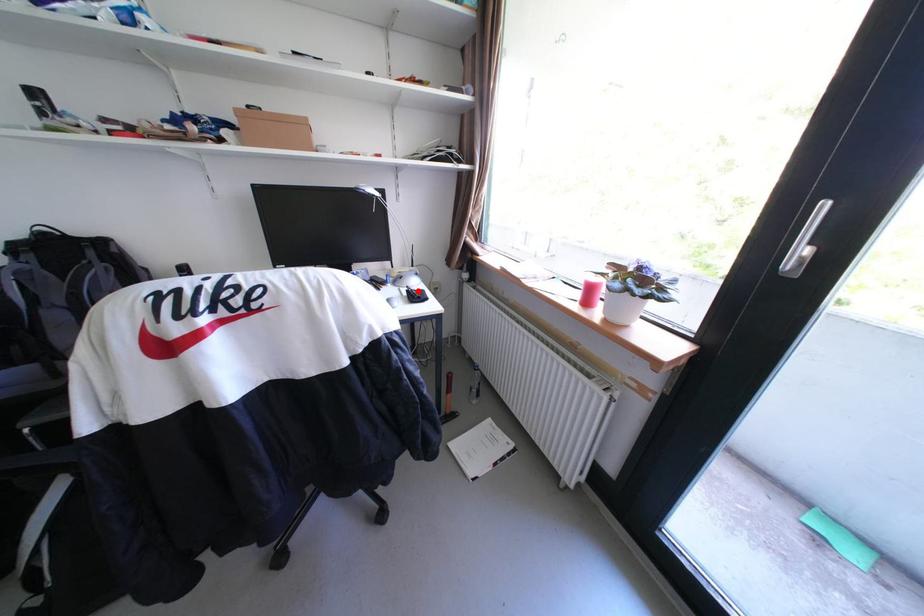
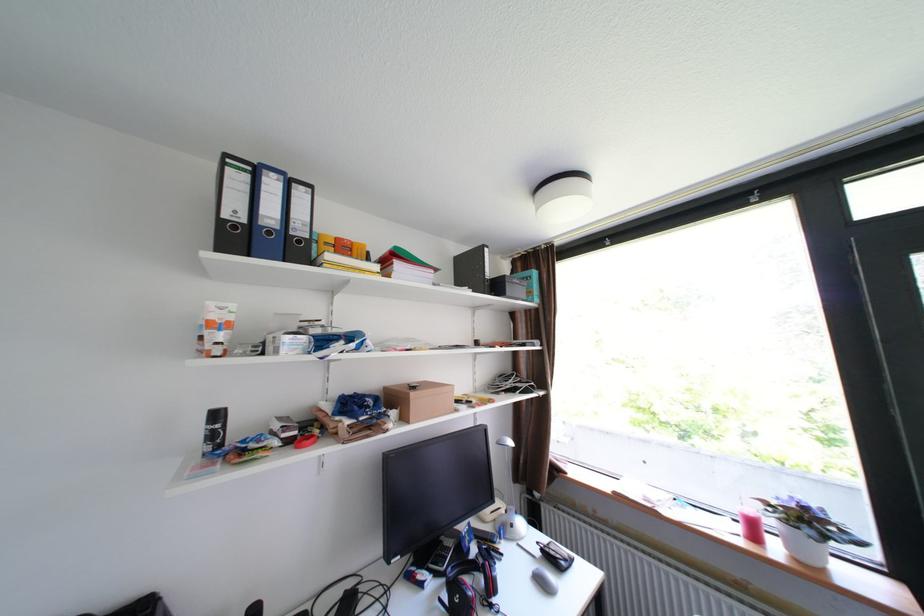
Question: I am providing you with two images of the same scene from different viewpoints. Image1 has a red point marked. In image2, the corresponding 3D location appears at what relative position? Reply with the corresponding letter.

Choices:
 (A) Closer
 (B) Farther

Answer: (A)